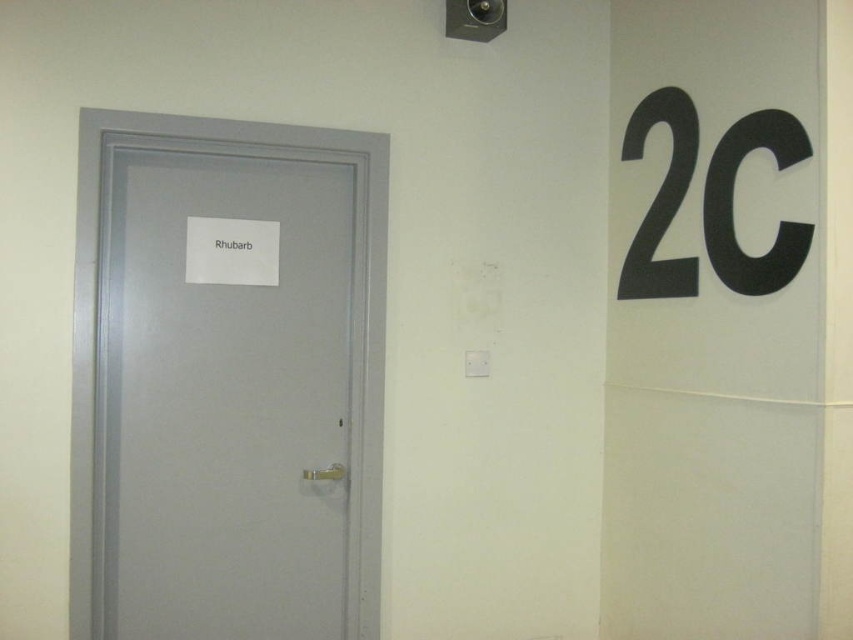
Based on the photo, you are standing in a hallway and need to locate the door labeled Rhubarb. You see the matte gray door at left and the black plastic number at upper right. Which object is positioned to the left of the other?

The matte gray door at left is to the left of the black plastic number at upper right.

You are standing in the hallway and need to reach the black plastic number at upper right. Is the matte gray door at left blocking your path to it?

The matte gray door at left is further to the viewer than the black plastic number at upper right, so the door is closer to you. This means the door is blocking your path to the black plastic number at upper right.

You are a delivery person carrying a box that is 1.5 meters long. You need to move it through the hallway shown in the image. Can you pass between the matte gray door at left and the black plastic number at upper right without tilting the box?

The distance between the matte gray door at left and the black plastic number at upper right is 1.26 meters. Since the box is 1.5 meters long, it cannot pass through the space between them without tilting.